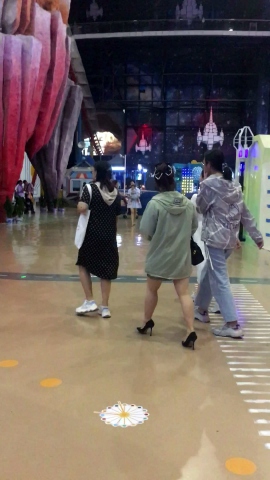
Identify the location of back walls. (77, 182).